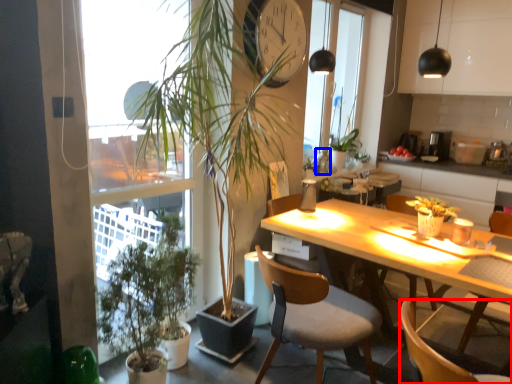
Question: Which object is further to the camera taking this photo, chair (highlighted by a red box) or bottle (highlighted by a blue box)?

Choices:
 (A) chair
 (B) bottle

Answer: (B)